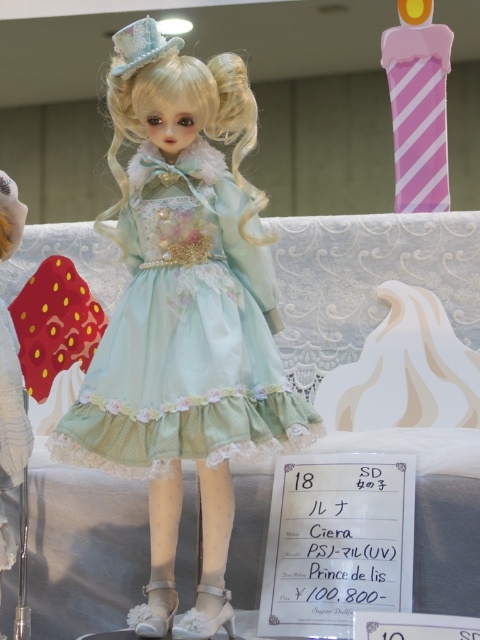
Between point (248, 227) and point (407, 131), which one is positioned in front?

Positioned in front is point (248, 227).

Can you confirm if satin light blue dress at center is taller than pink striped candle at upper right?

No, satin light blue dress at center is not taller than pink striped candle at upper right.

The image size is (480, 640). What do you see at coordinates (186, 333) in the screenshot?
I see `satin light blue dress at center` at bounding box center [186, 333].

Where is `satin light blue dress at center`? The image size is (480, 640). satin light blue dress at center is located at coordinates point(186,333).

Can you confirm if pink striped candle at upper right is positioned below white lace dress at left?

No, pink striped candle at upper right is not below white lace dress at left.

Between point (395, 176) and point (0, 220), which one is positioned behind?

Positioned behind is point (395, 176).

Describe the element at coordinates (419, 106) in the screenshot. This screenshot has width=480, height=640. I see `pink striped candle at upper right` at that location.

In order to click on pink striped candle at upper right in this screenshot , I will do `click(419, 106)`.

Can you confirm if satin light blue dress at center is smaller than white lace dress at left?

No.

Who is taller, satin light blue dress at center or white lace dress at left?

white lace dress at left is taller.

I want to click on satin light blue dress at center, so click(x=186, y=333).

Where is `satin light blue dress at center`? The image size is (480, 640). satin light blue dress at center is located at coordinates (186, 333).